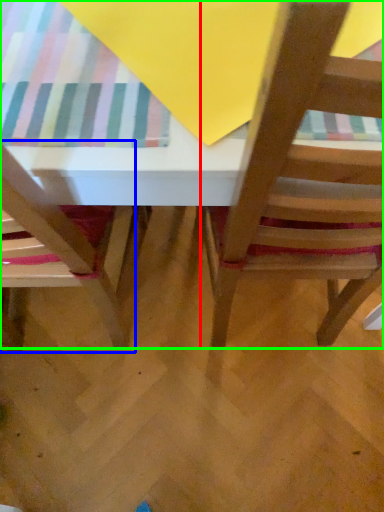
Question: Which is nearer to the chair (highlighted by a red box)? chair (highlighted by a blue box) or table (highlighted by a green box).

Choices:
 (A) chair
 (B) table

Answer: (B)